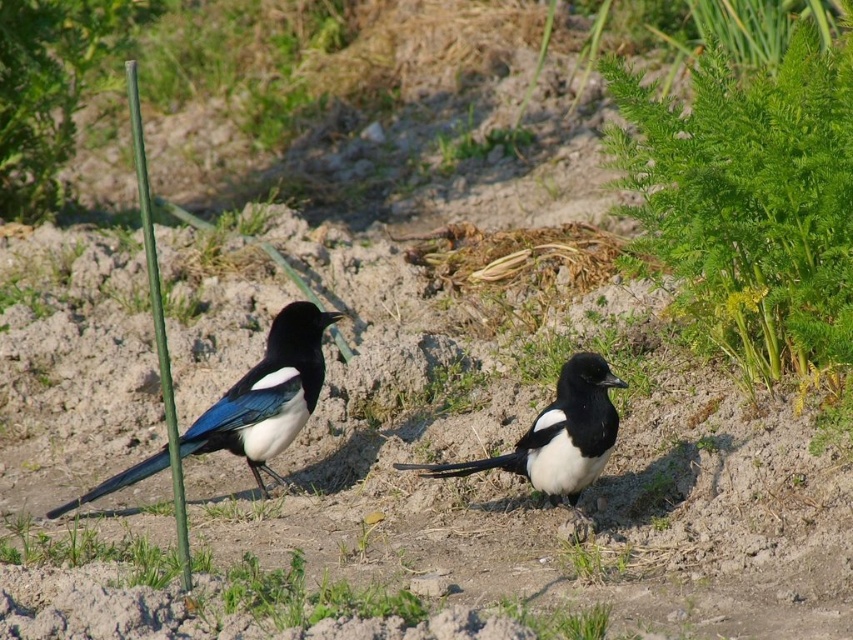
Question: Which object is closer to the camera taking this photo?

Choices:
 (A) green leafy grass at upper right
 (B) white glossy magpie at center
 (C) shiny black and white magpie at left

Answer: (B)

Question: Estimate the real-world distances between objects in this image. Which object is closer to the green leafy grass at upper right?

Choices:
 (A) white glossy magpie at center
 (B) shiny black and white magpie at left

Answer: (A)

Question: Can you confirm if green leafy grass at upper right is thinner than white glossy magpie at center?

Choices:
 (A) yes
 (B) no

Answer: (B)

Question: Which object is farther from the camera taking this photo?

Choices:
 (A) shiny black and white magpie at left
 (B) green leafy grass at upper right
 (C) white glossy magpie at center

Answer: (A)

Question: Does shiny black and white magpie at left appear on the left side of white glossy magpie at center?

Choices:
 (A) no
 (B) yes

Answer: (B)

Question: In this image, where is green leafy grass at upper right located relative to shiny black and white magpie at left?

Choices:
 (A) right
 (B) left

Answer: (A)